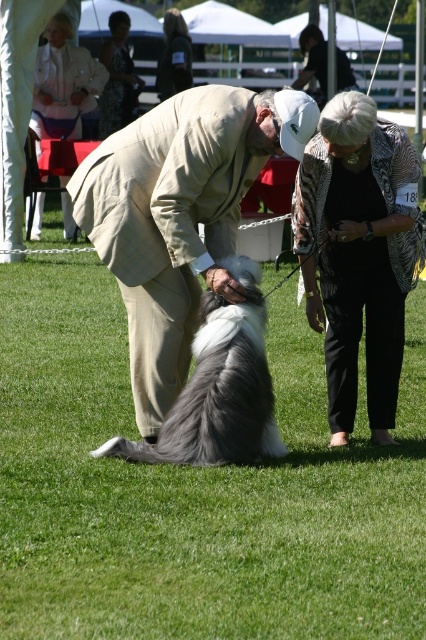
You are a photographer positioned at the back of the scene. You want to take a photo of the khaki suit at center and the black textured jacket at center. Which object should you focus on first to ensure both are in focus?

The black textured jacket at center is closer to the viewer than the khaki suit at center. To ensure both are in focus, you should focus on the khaki suit at center first since it is farther away, allowing the depth of field to cover the closer object as well.

You are organizing a dog show and need to ensure that the judges have enough space to move between the beige wool suit at center and the khaki suit at center. If the judges require a minimum of 0.5 meters between them and any obstacle, can they comfortably pass through the space between these two suits?

The beige wool suit at center is wider than the khaki suit at center. However, since the exact distance between them isn

You are a photographer at the dog show and need to position yourself so that both the beige wool suit at center and the khaki suit at center are visible in your shot. Which suit should you focus on first to ensure both are in frame?

The beige wool suit at center is smaller than the khaki suit at center, so you should focus on the khaki suit at center first to ensure both are in frame.